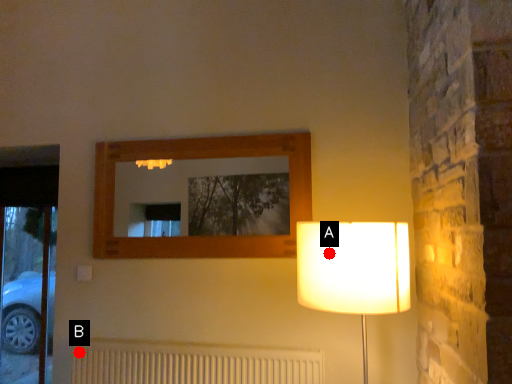
Question: Two points are circled on the image, labeled by A and B beside each circle. Which point is closer to the camera taking this photo?

Choices:
 (A) A is closer
 (B) B is closer

Answer: (A)